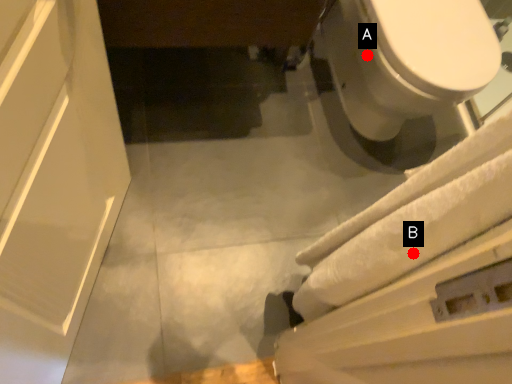
Question: Two points are circled on the image, labeled by A and B beside each circle. Which point is farther from the camera taking this photo?

Choices:
 (A) A is further
 (B) B is further

Answer: (A)